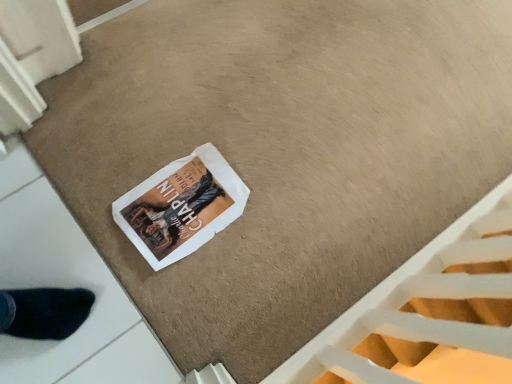
Where is `white paper magazine at center`? This screenshot has width=512, height=384. white paper magazine at center is located at coordinates (181, 206).

In order to face white paper magazine at center, should I rotate leftwards or rightwards?

To align with it, rotate left about 9.608°.

What do you see at coordinates (181, 206) in the screenshot? This screenshot has width=512, height=384. I see `white paper magazine at center` at bounding box center [181, 206].

What are the coordinates of `white textured stairwell at lower right` in the screenshot? It's located at (438, 308).

Looking at this image, what is the approximate height of white textured stairwell at lower right?

It is 62.21 centimeters.

The width and height of the screenshot is (512, 384). What do you see at coordinates (438, 308) in the screenshot?
I see `white textured stairwell at lower right` at bounding box center [438, 308].

Measure the distance between white textured stairwell at lower right and camera.

The distance of white textured stairwell at lower right from camera is 55.20 centimeters.

I want to click on white paper magazine at center, so click(181, 206).

Considering the relative positions of white textured stairwell at lower right and white paper magazine at center in the image provided, is white textured stairwell at lower right to the right of white paper magazine at center from the viewer's perspective?

Yes, white textured stairwell at lower right is to the right of white paper magazine at center.

Looking at this image, considering the positions of objects white textured stairwell at lower right and white paper magazine at center in the image provided, who is behind, white textured stairwell at lower right or white paper magazine at center?

white paper magazine at center is further away from the camera.

Does point (424, 355) appear closer or farther from the camera than point (180, 245)?

Point (424, 355).

From the image's perspective, is white textured stairwell at lower right located above white paper magazine at center?

No.

From a real-world perspective, which object rests below the other?

white paper magazine at center is physically lower.

Which of these two, white textured stairwell at lower right or white paper magazine at center, is wider?

With larger width is white paper magazine at center.

Who is taller, white textured stairwell at lower right or white paper magazine at center?

Standing taller between the two is white textured stairwell at lower right.

Does white textured stairwell at lower right have a larger size compared to white paper magazine at center?

Yes.

Is white textured stairwell at lower right not inside white paper magazine at center?

Indeed, white textured stairwell at lower right is completely outside white paper magazine at center.

Is white textured stairwell at lower right not close to white paper magazine at center?

No, there isn't a large distance between white textured stairwell at lower right and white paper magazine at center.

Is white paper magazine at center at the back of white textured stairwell at lower right?

white textured stairwell at lower right does not have its back to white paper magazine at center.

How different are the orientations of white textured stairwell at lower right and white paper magazine at center in degrees?

The facing directions of white textured stairwell at lower right and white paper magazine at center are 88.1 degrees apart.

Identify the location of magazine behind the white textured stairwell at lower right. (181, 206).

In the image, is white paper magazine at center on the left side or the right side of white textured stairwell at lower right?

white paper magazine at center is positioned on white textured stairwell at lower right's left side.

Relative to white textured stairwell at lower right, is white paper magazine at center in front or behind?

Result: Clearly, white paper magazine at center is behind white textured stairwell at lower right.

Is point (183, 228) less distant than point (372, 356)?

Yes, it is in front of point (372, 356).

From the image's perspective, would you say white paper magazine at center is positioned over white textured stairwell at lower right?

Yes, from the image's perspective, white paper magazine at center is over white textured stairwell at lower right.

From a real-world perspective, is white paper magazine at center positioned over white textured stairwell at lower right based on gravity?

No, from a real-world perspective, white paper magazine at center is not on top of white textured stairwell at lower right.

Is white paper magazine at center wider than white textured stairwell at lower right?

Correct, the width of white paper magazine at center exceeds that of white textured stairwell at lower right.

Considering the relative sizes of white paper magazine at center and white textured stairwell at lower right in the image provided, is white paper magazine at center shorter than white textured stairwell at lower right?

Yes.

Can you confirm if white paper magazine at center is smaller than white textured stairwell at lower right?

Indeed, white paper magazine at center has a smaller size compared to white textured stairwell at lower right.

Is white paper magazine at center spatially inside white textured stairwell at lower right, or outside of it?

The correct answer is: outside.

Is white paper magazine at center in contact with white textured stairwell at lower right?

No, white paper magazine at center is not with white textured stairwell at lower right.

Is white paper magazine at center looking in the opposite direction of white textured stairwell at lower right?

No, white paper magazine at center's orientation is not away from white textured stairwell at lower right.

How many degrees apart are the facing directions of white paper magazine at center and white textured stairwell at lower right?

Result: The angular difference between white paper magazine at center and white textured stairwell at lower right is 88.1 degrees.

The image size is (512, 384). I want to click on stairwell in front of the white paper magazine at center, so click(x=438, y=308).

This screenshot has height=384, width=512. I want to click on magazine that is under the white textured stairwell at lower right (from a real-world perspective), so click(x=181, y=206).

This screenshot has height=384, width=512. In order to click on magazine above the white textured stairwell at lower right (from the image's perspective) in this screenshot , I will do `click(181, 206)`.